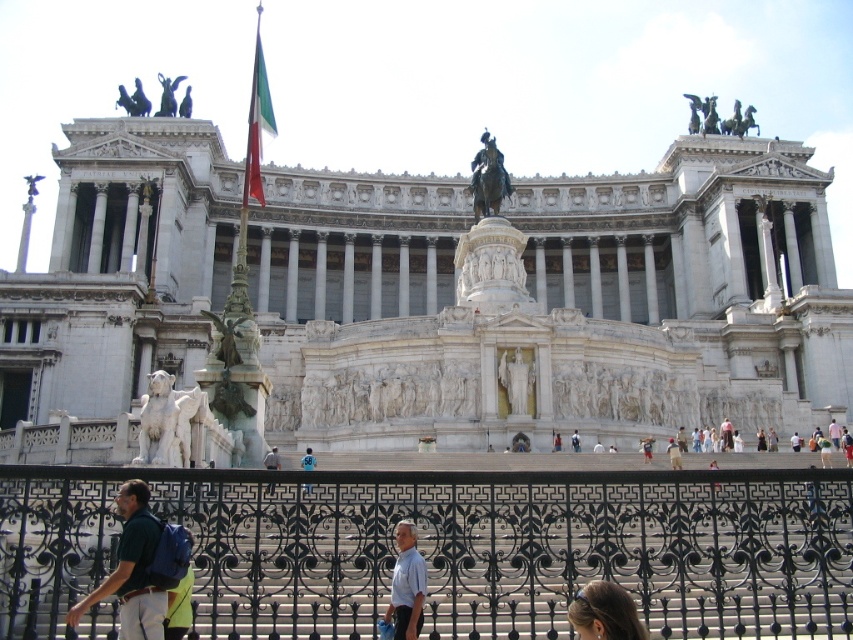
Which is behind, point (250, 176) or point (310, 486)?

Point (250, 176)

Between polished silk flag at center and light blue shirt at center, which one is positioned higher?

polished silk flag at center is above.

Identify the location of polished silk flag at center. This screenshot has height=640, width=853. (257, 125).

Is white marble palace at center thinner than bronze statue at center?

Incorrect, white marble palace at center's width is not less than bronze statue at center's.

Who is lower down, white marble palace at center or bronze statue at center?

white marble palace at center

Which is behind, point (654, 353) or point (485, 140)?

Point (485, 140)

Find the location of a particular element. white marble palace at center is located at coordinates (428, 296).

At what (x,y) coordinates should I click in order to perform the action: click on polished silk flag at center. Please return your answer as a coordinate pair (x, y). Looking at the image, I should click on (257, 125).

Is point (244, 179) more distant than point (494, 170)?

Yes, it is.

Who is more distant from viewer, (x=267, y=99) or (x=491, y=200)?

Point (x=491, y=200)

At what (x,y) coordinates should I click in order to perform the action: click on polished silk flag at center. Please return your answer as a coordinate pair (x, y). The height and width of the screenshot is (640, 853). Looking at the image, I should click on (257, 125).